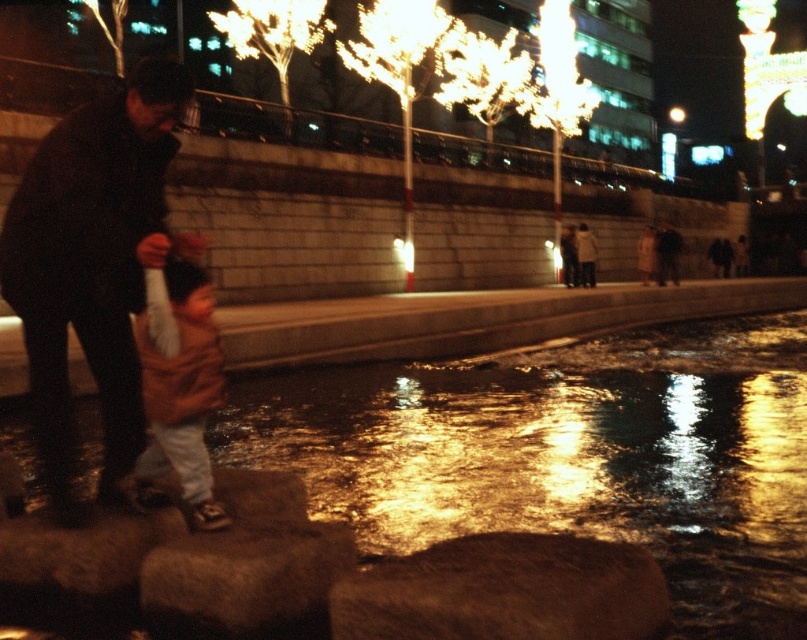
Question: Is dark brown leather jacket at left to the left of brown rough stone at center from the viewer's perspective?

Choices:
 (A) no
 (B) yes

Answer: (B)

Question: Observing the image, what is the correct spatial positioning of brown rough stone at center in reference to light brown cotton shirt at center?

Choices:
 (A) below
 (B) above

Answer: (A)

Question: Based on their relative distances, which object is farther from the dark brown leather jacket at left?

Choices:
 (A) brown rough stone at center
 (B) light brown cotton shirt at center

Answer: (A)

Question: Is dark brown leather jacket at left further to the viewer compared to light brown cotton shirt at center?

Choices:
 (A) yes
 (B) no

Answer: (A)

Question: Considering the real-world distances, which object is closest to the brown rough stone at center?

Choices:
 (A) dark brown leather jacket at left
 (B) light brown cotton shirt at center

Answer: (B)

Question: Which object appears farthest from the camera in this image?

Choices:
 (A) dark brown leather jacket at left
 (B) light brown cotton shirt at center

Answer: (A)